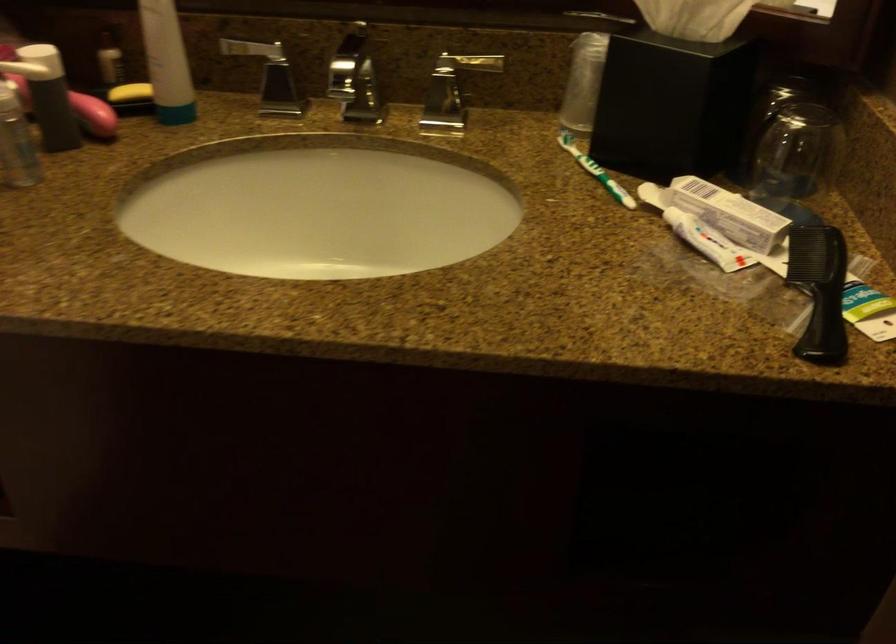
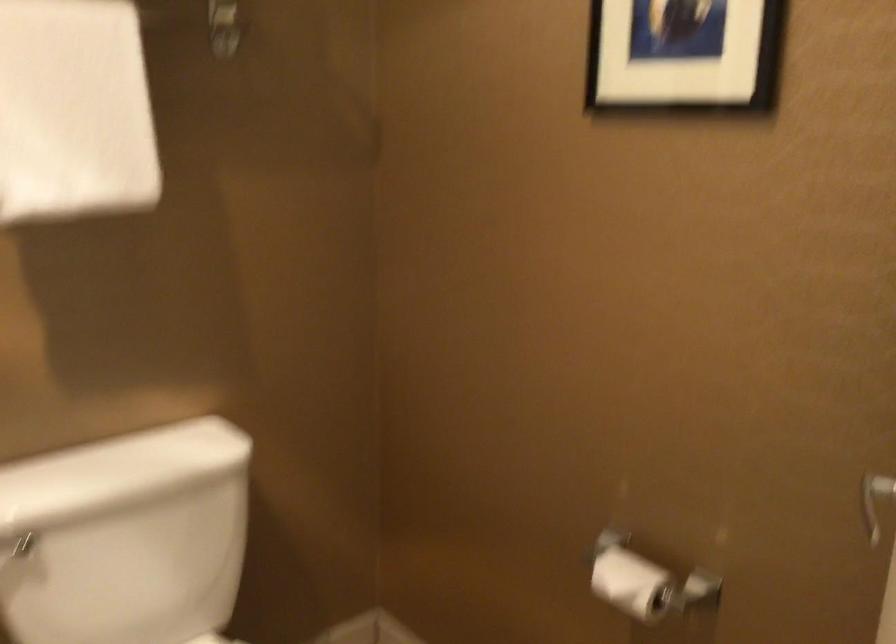
Question: The camera is either moving clockwise (left) or counter-clockwise (right) around the object. The first image is from the beginning of the video and the second image is from the end. Is the camera moving left or right when shooting the video?

Choices:
 (A) Left
 (B) Right

Answer: (B)